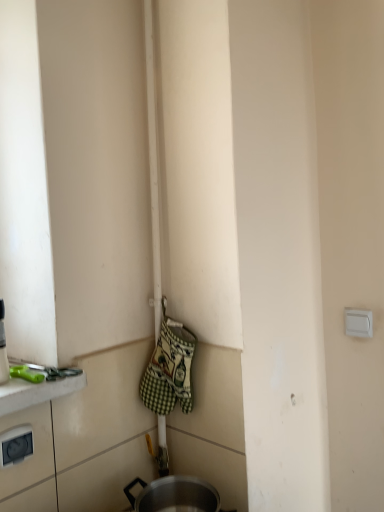
Question: Is green checkered fabric oven mitts at center oriented towards green plastic scissors at lower left?

Choices:
 (A) yes
 (B) no

Answer: (A)

Question: Is green checkered fabric oven mitts at center further to camera compared to green plastic scissors at lower left?

Choices:
 (A) yes
 (B) no

Answer: (A)

Question: Is green checkered fabric oven mitts at center at the left side of green plastic scissors at lower left?

Choices:
 (A) yes
 (B) no

Answer: (B)

Question: Is green checkered fabric oven mitts at center next to green plastic scissors at lower left and touching it?

Choices:
 (A) yes
 (B) no

Answer: (B)

Question: Would you say green plastic scissors at lower left is part of green checkered fabric oven mitts at center's contents?

Choices:
 (A) yes
 (B) no

Answer: (B)

Question: From a real-world perspective, does green checkered fabric oven mitts at center sit lower than green plastic scissors at lower left?

Choices:
 (A) yes
 (B) no

Answer: (A)

Question: Considering the relative sizes of green checkered fabric oven mitts at center and white plastic electric outlet at upper right, placed as the 1th electric outlet when sorted from right to left, in the image provided, is green checkered fabric oven mitts at center taller than white plastic electric outlet at upper right, placed as the 1th electric outlet when sorted from right to left,?

Choices:
 (A) yes
 (B) no

Answer: (A)

Question: Would you say green checkered fabric oven mitts at center is a long distance from white plastic electric outlet at upper right, which is the 2th electric outlet in bottom-to-top order?

Choices:
 (A) no
 (B) yes

Answer: (A)

Question: From a real-world perspective, is green checkered fabric oven mitts at center over white plastic electric outlet at upper right, the 1th electric outlet positioned from the top?

Choices:
 (A) no
 (B) yes

Answer: (A)

Question: Does green checkered fabric oven mitts at center have a larger size compared to white plastic electric outlet at upper right, the 2th electric outlet viewed from the left?

Choices:
 (A) no
 (B) yes

Answer: (B)

Question: Is green checkered fabric oven mitts at center outside of white plastic electric outlet at upper right, the 2th electric outlet viewed from the left?

Choices:
 (A) yes
 (B) no

Answer: (A)

Question: Is green checkered fabric oven mitts at center wider than white plastic electric outlet at upper right, the 1th electric outlet positioned from the top?

Choices:
 (A) no
 (B) yes

Answer: (B)

Question: Is green checkered fabric oven mitts at center surrounded by white plastic electric outlet at lower left, positioned as the 1th electric outlet in front-to-back order?

Choices:
 (A) no
 (B) yes

Answer: (A)